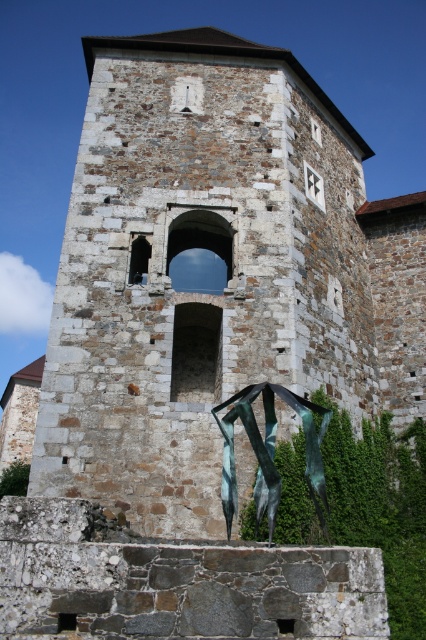
Can you confirm if stone tower at center is bigger than green patina metal sculpture at center?

Correct, stone tower at center is larger in size than green patina metal sculpture at center.

Where is `stone tower at center`? The width and height of the screenshot is (426, 640). stone tower at center is located at coordinates (198, 289).

Is point (143, 163) farther from camera compared to point (267, 396)?

Yes, point (143, 163) is farther from viewer.

Find the location of `stone tower at center`. stone tower at center is located at coordinates (198, 289).